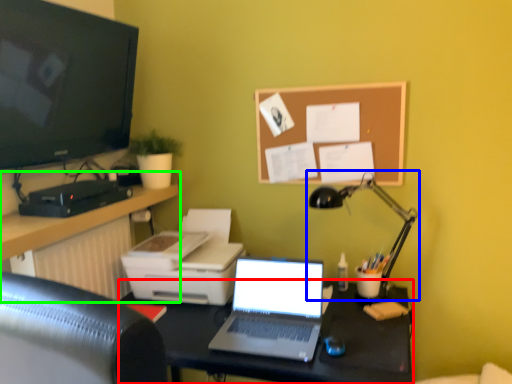
Question: Which object is positioned farthest from desk (highlighted by a red box)? Select from lamp (highlighted by a blue box) and computer desk (highlighted by a green box).

Choices:
 (A) lamp
 (B) computer desk

Answer: (B)